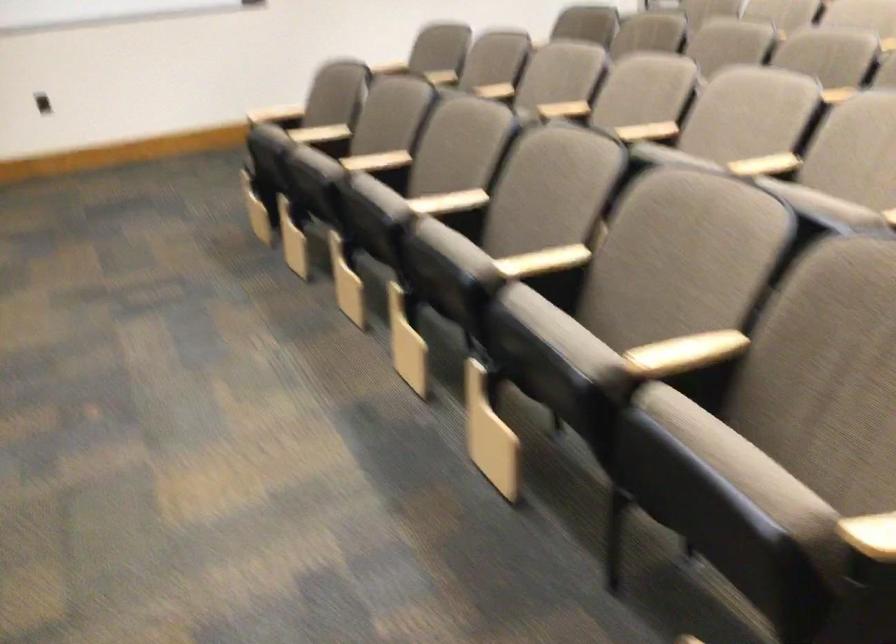
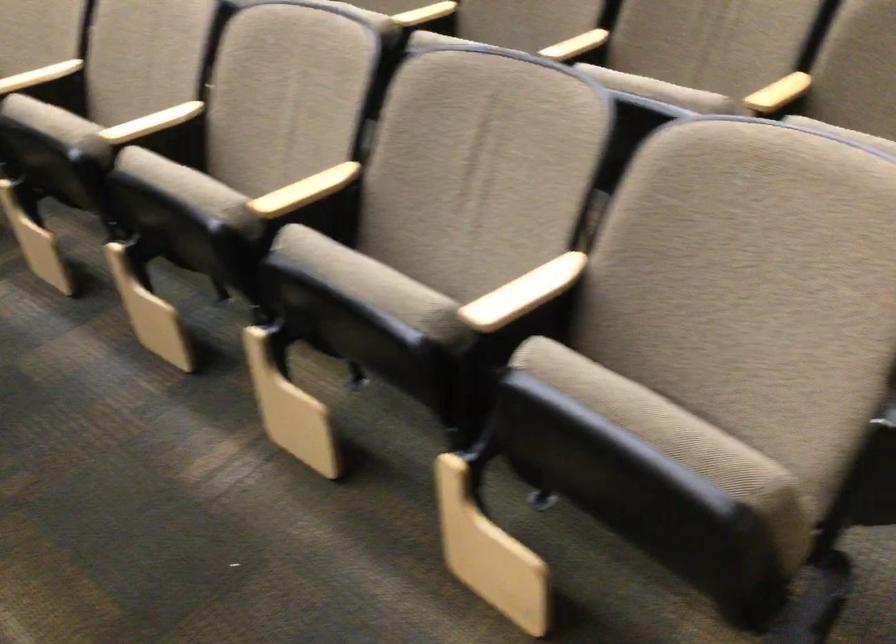
Question: What movement of the cameraman would produce the second image?

Choices:
 (A) Left
 (B) Right
 (C) Forward
 (D) Backward

Answer: (B)